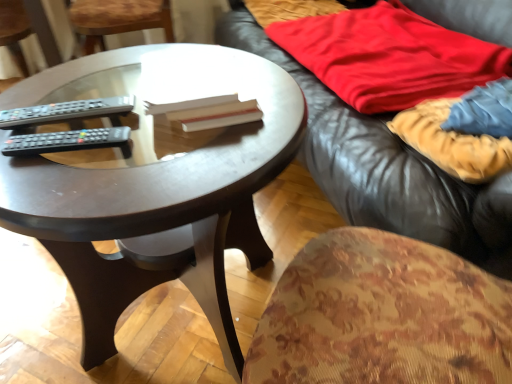
The image size is (512, 384). I want to click on dark wood coffee table at center, so click(x=152, y=191).

This screenshot has width=512, height=384. Describe the element at coordinates (389, 56) in the screenshot. I see `red cotton blanket at upper right, acting as the 2th blanket starting from the front` at that location.

Consider the image. Measure the distance between point (496,132) and camera.

Point (496,132) and camera are 31.77 inches apart.

Identify the location of velvet-like beige blanket at right, positioned as the first blanket in front-to-back order. (463, 131).

Describe the element at coordinates (385, 168) in the screenshot. The image size is (512, 384). I see `leather couch at upper right` at that location.

The height and width of the screenshot is (384, 512). I want to click on dark wood coffee table at center, so click(x=152, y=191).

Could you tell me if red cotton blanket at upper right, acting as the 2th blanket starting from the front, is turned towards black plastic remote control at left, which is the 1th remote control in front-to-back order?

No, red cotton blanket at upper right, acting as the 2th blanket starting from the front, is not facing towards black plastic remote control at left, which is the 1th remote control in front-to-back order.

Find the location of `remote control that is the 2nd one above the red cotton blanket at upper right, arranged as the first blanket when viewed from the back (from a real-world perspective)`. remote control that is the 2nd one above the red cotton blanket at upper right, arranged as the first blanket when viewed from the back (from a real-world perspective) is located at coordinates (68, 141).

Is red cotton blanket at upper right, acting as the 2th blanket starting from the front, in contact with black plastic remote control at left, which is the 1th remote control in front-to-back order?

No, red cotton blanket at upper right, acting as the 2th blanket starting from the front, is not with black plastic remote control at left, which is the 1th remote control in front-to-back order.

From the picture: From the image's perspective, who appears lower, red cotton blanket at upper right, arranged as the first blanket when viewed from the back, or black plastic remote control at left, which is the 1th remote control in front-to-back order?

black plastic remote control at left, which is the 1th remote control in front-to-back order.

Considering the sizes of objects black plastic remote at center, marked as the 1th remote control in a back-to-front arrangement, and wooden at left in the image provided, who is thinner, black plastic remote at center, marked as the 1th remote control in a back-to-front arrangement, or wooden at left?

With smaller width is black plastic remote at center, marked as the 1th remote control in a back-to-front arrangement.

Is black plastic remote at center, the 2th remote control in the front-to-back sequence, facing towards wooden at left?

No, black plastic remote at center, the 2th remote control in the front-to-back sequence, is not oriented towards wooden at left.

How many degrees apart are the facing directions of black plastic remote at center, marked as the 1th remote control in a back-to-front arrangement, and wooden at left?

They differ by 2.59 degrees in their facing directions.

Relative to wooden at left, is black plastic remote at center, the 2th remote control in the front-to-back sequence, in front or behind?

black plastic remote at center, the 2th remote control in the front-to-back sequence, is in front of wooden at left.

Is velvet-like beige blanket at right, positioned as the first blanket in front-to-back order, facing away from dark wood coffee table at center?

No, velvet-like beige blanket at right, positioned as the first blanket in front-to-back order, is not facing the opposite direction of dark wood coffee table at center.

Does velvet-like beige blanket at right, positioned as the first blanket in front-to-back order, have a smaller size compared to dark wood coffee table at center?

Indeed, velvet-like beige blanket at right, positioned as the first blanket in front-to-back order, has a smaller size compared to dark wood coffee table at center.

Identify the location of coffee table on the left of velvet-like beige blanket at right, positioned as the first blanket in front-to-back order. (152, 191).

From a real-world perspective, is velvet-like beige blanket at right, positioned as the first blanket in front-to-back order, physically located above or below dark wood coffee table at center?

velvet-like beige blanket at right, positioned as the first blanket in front-to-back order, is situated higher than dark wood coffee table at center in the real world.

Is point (262, 46) closer or farther from the camera than point (31, 78)?

Clearly, point (262, 46) is more distant from the camera than point (31, 78).

From the picture: Between leather couch at upper right and dark wood coffee table at center, which one appears on the right side from the viewer's perspective?

Positioned to the right is leather couch at upper right.

From a real-world perspective, is leather couch at upper right positioned above or below dark wood coffee table at center?

leather couch at upper right is above dark wood coffee table at center.

Does leather couch at upper right have a smaller size compared to dark wood coffee table at center?

No.

How many degrees apart are the facing directions of wooden at left and leather couch at upper right?

They differ by 5.49 degrees in their facing directions.

Who is bigger, wooden at left or leather couch at upper right?

leather couch at upper right is bigger.

Can you see wooden at left touching leather couch at upper right?

wooden at left is not next to leather couch at upper right, and they're not touching.

This screenshot has height=384, width=512. Find the location of `studio couch on the right of wooden at left`. studio couch on the right of wooden at left is located at coordinates (385, 168).

Considering the sizes of objects leather couch at upper right and black plastic remote control at left, positioned as the 2th remote control in back-to-front order, in the image provided, who is thinner, leather couch at upper right or black plastic remote control at left, positioned as the 2th remote control in back-to-front order,?

With smaller width is black plastic remote control at left, positioned as the 2th remote control in back-to-front order.

Is leather couch at upper right not inside black plastic remote control at left, positioned as the 2th remote control in back-to-front order?

Yes, leather couch at upper right is located beyond the bounds of black plastic remote control at left, positioned as the 2th remote control in back-to-front order.

Identify the location of studio couch in front of the black plastic remote control at left, which is the 1th remote control in front-to-back order. Image resolution: width=512 pixels, height=384 pixels. (385, 168).

Considering the positions of objects leather couch at upper right and black plastic remote at center, marked as the 1th remote control in a back-to-front arrangement, in the image provided, who is more to the right, leather couch at upper right or black plastic remote at center, marked as the 1th remote control in a back-to-front arrangement,?

Positioned to the right is leather couch at upper right.

From a real-world perspective, is leather couch at upper right above or below black plastic remote at center, marked as the 1th remote control in a back-to-front arrangement?

From a real-world perspective, leather couch at upper right is physically below black plastic remote at center, marked as the 1th remote control in a back-to-front arrangement.

This screenshot has width=512, height=384. Find the location of `remote control that is the 2nd object located behind the leather couch at upper right`. remote control that is the 2nd object located behind the leather couch at upper right is located at coordinates (67, 112).

Is leather couch at upper right inside the boundaries of black plastic remote at center, the 2th remote control in the front-to-back sequence, or outside?

The correct answer is: outside.

From the image's perspective, count 2nd blankets upward from the black plastic remote control at left, which is the 1th remote control in front-to-back order, and point to it. Please provide its 2D coordinates.

[(389, 56)]

The height and width of the screenshot is (384, 512). I want to click on chair on the left of black plastic remote at center, marked as the 1th remote control in a back-to-front arrangement, so click(118, 19).

When comparing their distances from black plastic remote control at left, which is the 1th remote control in front-to-back order, does dark wood coffee table at center or black plastic remote at center, the 2th remote control in the front-to-back sequence, seem further?

Based on the image, dark wood coffee table at center appears to be further to black plastic remote control at left, which is the 1th remote control in front-to-back order.

From the image, which object appears to be farther from wooden at left, dark wood coffee table at center or leather couch at upper right?

dark wood coffee table at center is positioned further to the anchor wooden at left.

Considering their positions, is black plastic remote control at left, which is the 1th remote control in front-to-back order, positioned closer to velvet-like beige blanket at right, positioned as the first blanket in front-to-back order, than black plastic remote at center, the 2th remote control in the front-to-back sequence?

black plastic remote at center, the 2th remote control in the front-to-back sequence, lies closer to velvet-like beige blanket at right, positioned as the first blanket in front-to-back order, than the other object.

Estimate the real-world distances between objects in this image. Which object is closer to red cotton blanket at upper right, arranged as the first blanket when viewed from the back, black plastic remote at center, the 2th remote control in the front-to-back sequence, or leather couch at upper right?

leather couch at upper right lies closer to red cotton blanket at upper right, arranged as the first blanket when viewed from the back, than the other object.

Considering their positions, is velvet-like beige blanket at right, placed as the 2th blanket when sorted from back to front, positioned closer to black plastic remote control at left, positioned as the 2th remote control in back-to-front order, than black plastic remote at center, marked as the 1th remote control in a back-to-front arrangement?

Based on the image, black plastic remote at center, marked as the 1th remote control in a back-to-front arrangement, appears to be nearer to black plastic remote control at left, positioned as the 2th remote control in back-to-front order.

From the image, which object appears to be farther from red cotton blanket at upper right, arranged as the first blanket when viewed from the back, black plastic remote control at left, which is the 1th remote control in front-to-back order, or black plastic remote at center, the 2th remote control in the front-to-back sequence?

Based on the image, black plastic remote control at left, which is the 1th remote control in front-to-back order, appears to be further to red cotton blanket at upper right, arranged as the first blanket when viewed from the back.

Based on the photo, from the image, which object appears to be farther from wooden at left, black plastic remote control at left, positioned as the 2th remote control in back-to-front order, or leather couch at upper right?

black plastic remote control at left, positioned as the 2th remote control in back-to-front order.

Based on their spatial positions, is leather couch at upper right or wooden at left further from dark wood coffee table at center?

wooden at left is further to dark wood coffee table at center.

The image size is (512, 384). Find the location of `blanket between leather couch at upper right and red cotton blanket at upper right, arranged as the first blanket when viewed from the back, from front to back`. blanket between leather couch at upper right and red cotton blanket at upper right, arranged as the first blanket when viewed from the back, from front to back is located at coordinates click(x=463, y=131).

Locate an element on the screen. This screenshot has height=384, width=512. coffee table situated between black plastic remote control at left, which is the 1th remote control in front-to-back order, and velvet-like beige blanket at right, placed as the 2th blanket when sorted from back to front, from left to right is located at coordinates (152, 191).

Find the location of a particular element. Image resolution: width=512 pixels, height=384 pixels. remote control located between dark wood coffee table at center and black plastic remote at center, the 2th remote control in the front-to-back sequence, in the depth direction is located at coordinates (68, 141).

Where is `remote control situated between black plastic remote at center, marked as the 1th remote control in a back-to-front arrangement, and velvet-like beige blanket at right, positioned as the first blanket in front-to-back order, from left to right`? The image size is (512, 384). remote control situated between black plastic remote at center, marked as the 1th remote control in a back-to-front arrangement, and velvet-like beige blanket at right, positioned as the first blanket in front-to-back order, from left to right is located at coordinates (68, 141).